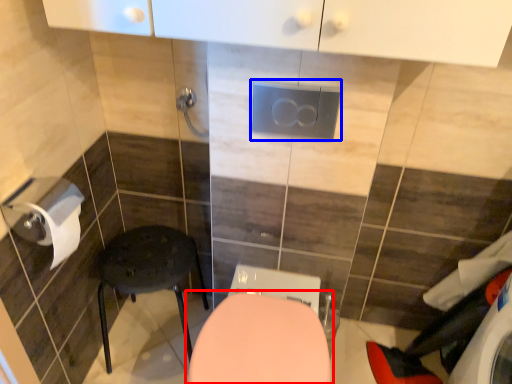
Question: Which of the following is the farthest to the observer, toilet (highlighted by a red box) or electric outlet (highlighted by a blue box)?

Choices:
 (A) toilet
 (B) electric outlet

Answer: (B)